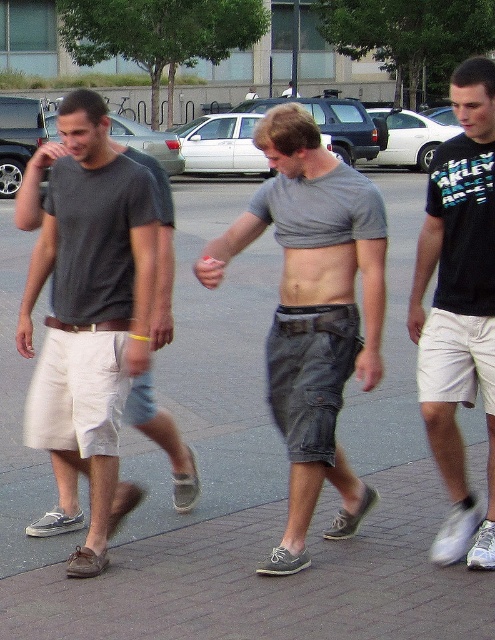
Can you confirm if gray concrete pavement at center is positioned to the left of gray cotton shorts at center?

Indeed, gray concrete pavement at center is positioned on the left side of gray cotton shorts at center.

Which is behind, point (242, 188) or point (283, 228)?

The point (242, 188) is behind.

At what (x,y) coordinates should I click in order to perform the action: click on gray concrete pavement at center. Please return your answer as a coordinate pair (x, y). Image resolution: width=495 pixels, height=640 pixels. Looking at the image, I should click on (240, 474).

The width and height of the screenshot is (495, 640). What do you see at coordinates (240, 474) in the screenshot? I see `gray concrete pavement at center` at bounding box center [240, 474].

Is gray concrete pavement at center smaller than matte gray t-shirt at left?

Actually, gray concrete pavement at center might be larger than matte gray t-shirt at left.

This screenshot has height=640, width=495. Find the location of `gray concrete pavement at center`. gray concrete pavement at center is located at coordinates (240, 474).

This screenshot has height=640, width=495. I want to click on gray concrete pavement at center, so click(x=240, y=474).

Who is more distant from viewer, [267,381] or [124,508]?

Point [267,381]

Measure the distance between point (333, 250) and camera.

Point (333, 250) and camera are 5.46 meters apart from each other.

Where is `gray cotton shorts at center`? Image resolution: width=495 pixels, height=640 pixels. gray cotton shorts at center is located at coordinates (312, 312).